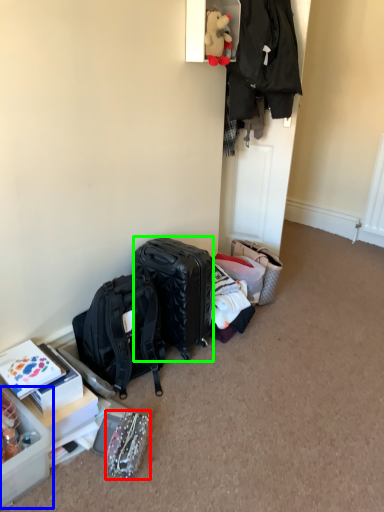
Question: Considering the real-world distances, which object is farthest from bag (highlighted by a red box)? box (highlighted by a blue box) or luggage and bags (highlighted by a green box)?

Choices:
 (A) box
 (B) luggage and bags

Answer: (B)